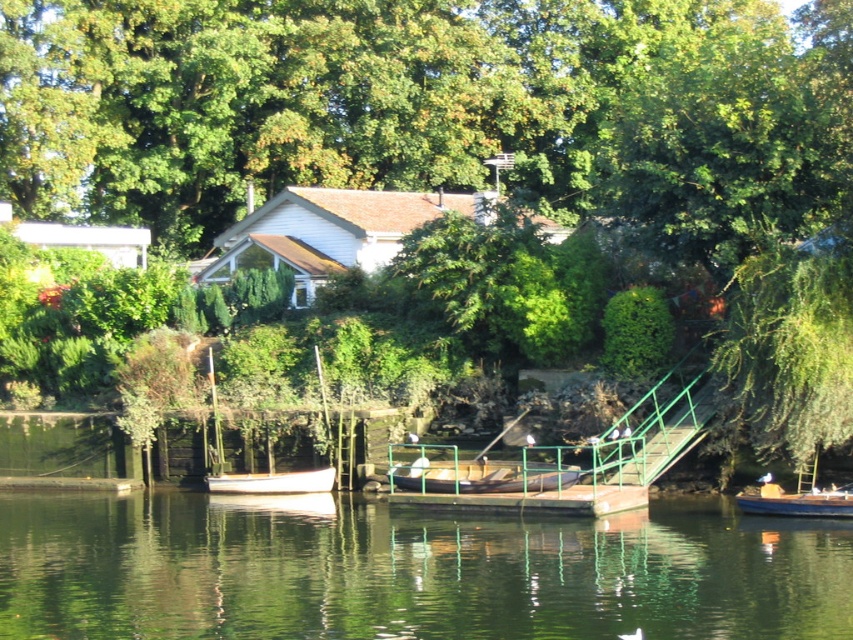
Question: Which point appears farthest from the camera in this image?

Choices:
 (A) (770, 486)
 (B) (521, 490)

Answer: (B)

Question: Is green reflective water at center positioned behind wooden boat at center?

Choices:
 (A) yes
 (B) no

Answer: (B)

Question: Considering the real-world distances, which object is closest to the wooden boat at center?

Choices:
 (A) wooden boat at lower right
 (B) green reflective water at center

Answer: (A)

Question: Which object is closer to the camera taking this photo?

Choices:
 (A) white matte boat at lower left
 (B) wooden boat at center
 (C) wooden boat at lower right

Answer: (C)

Question: Can you confirm if green reflective water at center is thinner than wooden boat at lower right?

Choices:
 (A) yes
 (B) no

Answer: (B)

Question: Is green reflective water at center wider than green metallic staircase at center?

Choices:
 (A) no
 (B) yes

Answer: (B)